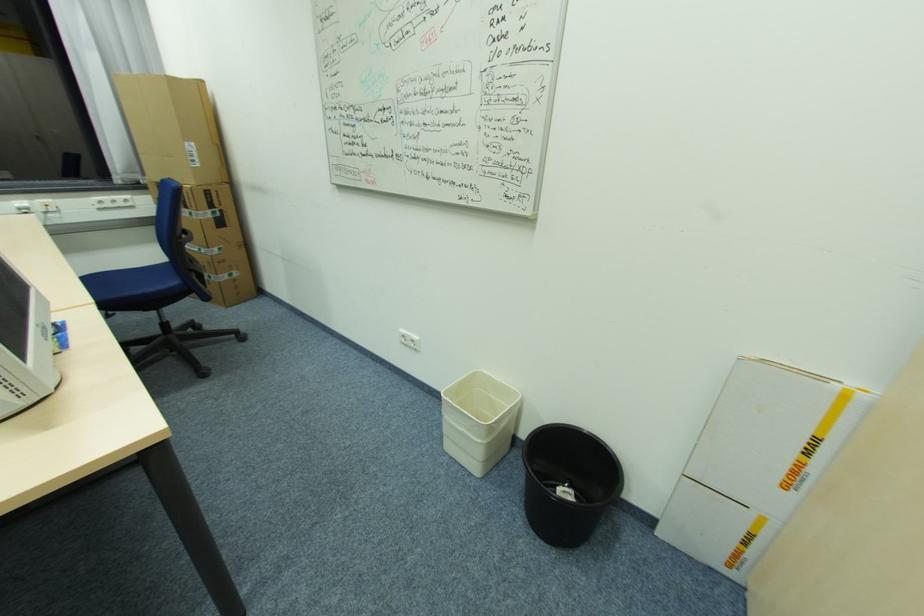
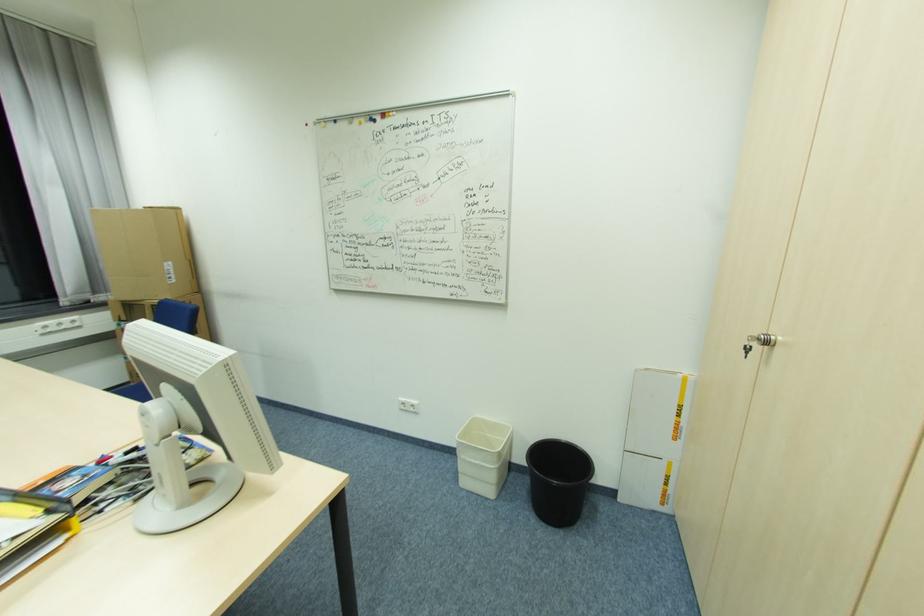
Where in the second image is the point corresponding to point 797,472 from the first image?

(681, 430)